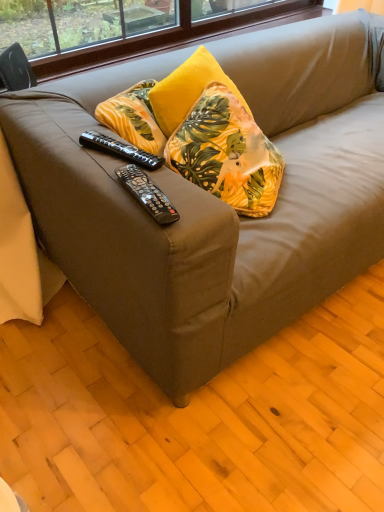
Question: Is black plastic remote control at center, placed as the first remote control when sorted from top to bottom, positioned beyond the bounds of yellow fabric pillow at center?

Choices:
 (A) yes
 (B) no

Answer: (A)

Question: Is black plastic remote control at center, which appears as the second remote control when viewed from the front, further to the viewer compared to yellow fabric pillow at center?

Choices:
 (A) yes
 (B) no

Answer: (B)

Question: Is black plastic remote control at center, the 1th remote control positioned from the back, taller than yellow fabric pillow at center?

Choices:
 (A) yes
 (B) no

Answer: (B)

Question: Does black plastic remote control at center, positioned as the 2th remote control in bottom-to-top order, appear on the left side of yellow fabric pillow at center?

Choices:
 (A) no
 (B) yes

Answer: (B)

Question: From the image's perspective, is black plastic remote control at center, positioned as the 2th remote control in bottom-to-top order, below yellow fabric pillow at center?

Choices:
 (A) yes
 (B) no

Answer: (A)

Question: In terms of width, does yellow fabric pillow at center look wider or thinner when compared to black plastic remote control at center, marked as the first remote control in a bottom-to-top arrangement?

Choices:
 (A) thin
 (B) wide

Answer: (B)

Question: Is point click(210, 131) closer or farther from the camera than point click(168, 211)?

Choices:
 (A) farther
 (B) closer

Answer: (A)

Question: Considering their positions, is yellow fabric pillow at center located in front of or behind black plastic remote control at center, which is the 2th remote control from top to bottom?

Choices:
 (A) front
 (B) behind

Answer: (B)

Question: Considering the positions of yellow fabric pillow at center and black plastic remote control at center, the 1th remote control positioned from the front, in the image, is yellow fabric pillow at center taller or shorter than black plastic remote control at center, the 1th remote control positioned from the front,?

Choices:
 (A) tall
 (B) short

Answer: (A)

Question: Visually, is black plastic remote control at center, positioned as the second remote control in back-to-front order, positioned to the left or to the right of black plastic remote control at center, placed as the first remote control when sorted from top to bottom?

Choices:
 (A) right
 (B) left

Answer: (A)

Question: Is black plastic remote control at center, marked as the first remote control in a bottom-to-top arrangement, taller or shorter than black plastic remote control at center, the 1th remote control positioned from the back?

Choices:
 (A) short
 (B) tall

Answer: (B)

Question: Looking at their shapes, would you say black plastic remote control at center, marked as the first remote control in a bottom-to-top arrangement, is wider or thinner than black plastic remote control at center, the 1th remote control positioned from the back?

Choices:
 (A) wide
 (B) thin

Answer: (B)

Question: Which is correct: black plastic remote control at center, positioned as the second remote control in back-to-front order, is inside black plastic remote control at center, placed as the first remote control when sorted from top to bottom, or outside of it?

Choices:
 (A) inside
 (B) outside

Answer: (B)

Question: Does point (89, 143) appear closer or farther from the camera than point (155, 210)?

Choices:
 (A) farther
 (B) closer

Answer: (A)

Question: Considering the relative positions of black plastic remote control at center, positioned as the 2th remote control in bottom-to-top order, and black plastic remote control at center, which is the 2th remote control from top to bottom, in the image provided, is black plastic remote control at center, positioned as the 2th remote control in bottom-to-top order, to the left or to the right of black plastic remote control at center, which is the 2th remote control from top to bottom,?

Choices:
 (A) right
 (B) left

Answer: (B)